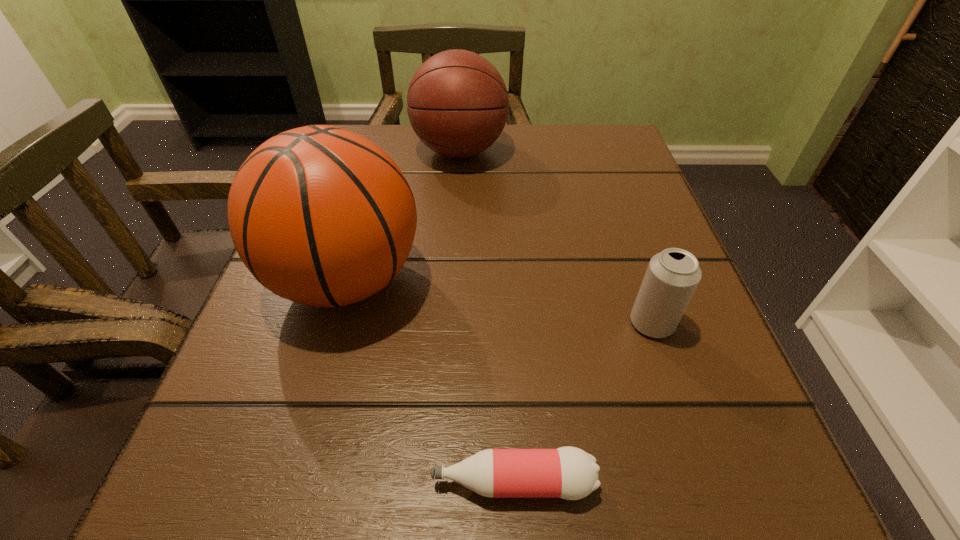
At what (x,y) coordinates should I click in order to perform the action: click on the taller basketball. Please return your answer as a coordinate pair (x, y). The height and width of the screenshot is (540, 960). Looking at the image, I should click on (320, 215).

You are a GUI agent. You are given a task and a screenshot of the screen. Output one action in this format:
    pyautogui.click(x=<x>, y=<y>)
    Task: Click on the nearer basketball
    
    Given the screenshot: What is the action you would take?
    pyautogui.click(x=320, y=215)

What are the coordinates of `the shorter basketball` in the screenshot? It's located at (457, 103).

Identify the location of the farther basketball. (457, 103).

You are a GUI agent. You are given a task and a screenshot of the screen. Output one action in this format:
    pyautogui.click(x=<x>, y=<y>)
    Task: Click on the second shortest object
    
    Given the screenshot: What is the action you would take?
    pyautogui.click(x=672, y=276)

This screenshot has width=960, height=540. I want to click on the rightmost object, so click(672, 276).

Image resolution: width=960 pixels, height=540 pixels. I want to click on the nearest object, so click(x=570, y=473).

Where is `the shortest object`? The width and height of the screenshot is (960, 540). the shortest object is located at coordinates (570, 473).

Locate an element on the screen. Image resolution: width=960 pixels, height=540 pixels. vacant position located 0.200m on the right of the nearer basketball is located at coordinates (550, 281).

In order to click on free space located 0.380m on the front of the second tallest object in this screenshot , I will do `click(449, 327)`.